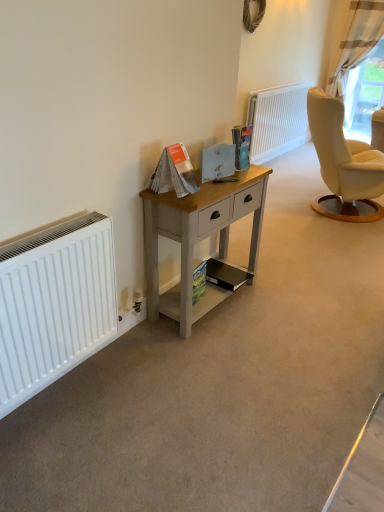
The image size is (384, 512). What are the coordinates of `matte blue card at center, which is counted as the 4th magazine, starting from the bottom` in the screenshot? It's located at (218, 161).

The height and width of the screenshot is (512, 384). What do you see at coordinates (365, 91) in the screenshot?
I see `transparent glass window at upper right` at bounding box center [365, 91].

What do you see at coordinates (199, 280) in the screenshot? I see `green matte magazine at lower center, the fifth magazine when ordered from top to bottom` at bounding box center [199, 280].

Describe the element at coordinates (242, 146) in the screenshot. I see `matte paper magazine at center, which is the first magazine from top to bottom` at that location.

Measure the distance between point [179,173] and camera.

They are 6.26 feet apart.

Locate an element on the screen. The image size is (384, 512). matte black magazine at lower center, which ranks as the 2th magazine in bottom-to-top order is located at coordinates (225, 275).

Does point (175, 205) come farther from viewer compared to point (254, 125)?

That is False.

Is light gray wood desk at center taller than white matte radiator at upper center, which appears as the first radiator when viewed from the top?

Incorrect, the height of light gray wood desk at center is not larger of that of white matte radiator at upper center, which appears as the first radiator when viewed from the top.

At what (x,y) coordinates should I click in order to perform the action: click on desk below the white matte radiator at upper center, which appears as the first radiator when viewed from the top (from the image's perspective). Please return your answer as a coordinate pair (x, y). Looking at the image, I should click on (x=198, y=238).

Is light gray wood desk at center aimed at white matte radiator at upper center, which is the second radiator in front-to-back order?

No, light gray wood desk at center is not aimed at white matte radiator at upper center, which is the second radiator in front-to-back order.

Is white matte radiator at lower left, which is the 1th radiator from left to right, not near light gray wood desk at center?

No, white matte radiator at lower left, which is the 1th radiator from left to right, is not far from light gray wood desk at center.

Which is behind, white matte radiator at lower left, which is the first radiator from bottom to top, or light gray wood desk at center?

light gray wood desk at center.

Considering the relative sizes of white matte radiator at lower left, which is the first radiator from bottom to top, and light gray wood desk at center in the image provided, is white matte radiator at lower left, which is the first radiator from bottom to top, shorter than light gray wood desk at center?

Correct, white matte radiator at lower left, which is the first radiator from bottom to top, is not as tall as light gray wood desk at center.

Can you confirm if white matte radiator at lower left, which is counted as the 2th radiator, starting from the right, is bigger than light gray wood desk at center?

No, white matte radiator at lower left, which is counted as the 2th radiator, starting from the right, is not bigger than light gray wood desk at center.

I want to click on the 1st magazine to the left when counting from the matte blue card at center, which is counted as the 4th magazine, starting from the bottom, so click(199, 280).

Does matte blue card at center, which is counted as the 4th magazine, starting from the bottom, touch green matte magazine at lower center, the fifth magazine when ordered from top to bottom?

No, matte blue card at center, which is counted as the 4th magazine, starting from the bottom, is not making contact with green matte magazine at lower center, the fifth magazine when ordered from top to bottom.

Which object is wider, matte blue card at center, which is counted as the second magazine, starting from the top, or green matte magazine at lower center, the 1th magazine positioned from the bottom?

With larger width is matte blue card at center, which is counted as the second magazine, starting from the top.

How many degrees apart are the facing directions of matte blue card at center, which is counted as the second magazine, starting from the top, and white matte radiator at upper center, which ranks as the second radiator in bottom-to-top order?

The angular difference between matte blue card at center, which is counted as the second magazine, starting from the top, and white matte radiator at upper center, which ranks as the second radiator in bottom-to-top order, is 3.82 degrees.

Based on the photo, is matte blue card at center, which is counted as the second magazine, starting from the top, thinner than white matte radiator at upper center, which ranks as the second radiator in bottom-to-top order?

Correct, the width of matte blue card at center, which is counted as the second magazine, starting from the top, is less than that of white matte radiator at upper center, which ranks as the second radiator in bottom-to-top order.

Is white matte radiator at upper center, which is counted as the second radiator, starting from the left, at the back of matte blue card at center, which is counted as the second magazine, starting from the top?

No, matte blue card at center, which is counted as the second magazine, starting from the top, is not facing the opposite direction of white matte radiator at upper center, which is counted as the second radiator, starting from the left.

Is matte blue card at center, which is counted as the second magazine, starting from the top, shorter than white matte radiator at upper center, which is counted as the first radiator, starting from the back?

Yes.

Which object is thinner, matte blue card at center, which is counted as the second magazine, starting from the top, or transparent glass window at upper right?

matte blue card at center, which is counted as the second magazine, starting from the top.

How different are the orientations of matte blue card at center, which is counted as the second magazine, starting from the top, and transparent glass window at upper right in degrees?

The facing directions of matte blue card at center, which is counted as the second magazine, starting from the top, and transparent glass window at upper right are 85.6 degrees apart.

Which of these two, matte blue card at center, which is counted as the 4th magazine, starting from the bottom, or transparent glass window at upper right, stands shorter?

matte blue card at center, which is counted as the 4th magazine, starting from the bottom, is shorter.

From a real-world perspective, which object stands above the other?

In real-world perspective, matte blue card at center, which is counted as the 4th magazine, starting from the bottom, is above.

Which of these two, light gray wood desk at center or matte paper magazine at center, arranged as the third magazine when viewed from the top, is wider?

With larger width is light gray wood desk at center.

Based on the photo, is matte paper magazine at center, marked as the 3th magazine in a bottom-to-top arrangement, inside light gray wood desk at center?

No.

This screenshot has width=384, height=512. I want to click on desk that is under the matte paper magazine at center, marked as the 3th magazine in a bottom-to-top arrangement (from a real-world perspective), so click(x=198, y=238).

Based on the photo, considering the positions of objects white matte radiator at upper center, which ranks as the second radiator in bottom-to-top order, and white textured curtain at upper right in the image provided, who is more to the left, white matte radiator at upper center, which ranks as the second radiator in bottom-to-top order, or white textured curtain at upper right?

Positioned to the left is white matte radiator at upper center, which ranks as the second radiator in bottom-to-top order.

Is white matte radiator at upper center, which ranks as the second radiator in bottom-to-top order, far away from white textured curtain at upper right?

That's right, there is a large distance between white matte radiator at upper center, which ranks as the second radiator in bottom-to-top order, and white textured curtain at upper right.

From the image's perspective, does white matte radiator at upper center, which is the second radiator in front-to-back order, appear lower than white textured curtain at upper right?

Yes, from the image's perspective, white matte radiator at upper center, which is the second radiator in front-to-back order, is below white textured curtain at upper right.

Considering the sizes of white matte radiator at upper center, which appears as the first radiator when viewed from the top, and white textured curtain at upper right in the image, is white matte radiator at upper center, which appears as the first radiator when viewed from the top, wider or thinner than white textured curtain at upper right?

Clearly, white matte radiator at upper center, which appears as the first radiator when viewed from the top, has less width compared to white textured curtain at upper right.

What are the coordinates of `desk below the white matte radiator at upper center, which is counted as the second radiator, starting from the left (from the image's perspective)` in the screenshot? It's located at (198, 238).

The image size is (384, 512). I want to click on desk behind the white matte radiator at lower left, the first radiator when ordered from front to back, so click(198, 238).

Looking at the image, which one is located closer to transparent glass window at upper right, matte paper magazine at center, arranged as the third magazine when viewed from the top, or green matte magazine at lower center, the 1th magazine positioned from the bottom?

Based on the image, green matte magazine at lower center, the 1th magazine positioned from the bottom, appears to be nearer to transparent glass window at upper right.

Estimate the real-world distances between objects in this image. Which object is closer to transparent glass window at upper right, matte paper magazine at center, which is the first magazine from top to bottom, or white matte radiator at upper center, which appears as the first radiator when viewed from the top?

Among the two, white matte radiator at upper center, which appears as the first radiator when viewed from the top, is located nearer to transparent glass window at upper right.

From the image, which object appears to be nearer to green matte magazine at lower center, the fifth magazine when ordered from top to bottom, white matte radiator at upper center, which appears as the first radiator when viewed from the top, or white textured curtain at upper right?

white matte radiator at upper center, which appears as the first radiator when viewed from the top, is positioned closer to the anchor green matte magazine at lower center, the fifth magazine when ordered from top to bottom.

Estimate the real-world distances between objects in this image. Which object is further from matte blue card at center, which is counted as the 4th magazine, starting from the bottom, matte paper magazine at center, marked as the 3th magazine in a bottom-to-top arrangement, or light gray wood desk at center?

light gray wood desk at center is further to matte blue card at center, which is counted as the 4th magazine, starting from the bottom.

Looking at the image, which one is located closer to light gray wood desk at center, transparent glass window at upper right or white textured curtain at upper right?

transparent glass window at upper right is closer to light gray wood desk at center.

Estimate the real-world distances between objects in this image. Which object is closer to white matte radiator at upper center, which is counted as the second radiator, starting from the left, matte blue card at center, which is counted as the second magazine, starting from the top, or matte paper magazine at center, which is the first magazine from top to bottom?

Among the two, matte paper magazine at center, which is the first magazine from top to bottom, is located nearer to white matte radiator at upper center, which is counted as the second radiator, starting from the left.

Considering their positions, is matte blue card at center, which is counted as the 4th magazine, starting from the bottom, positioned closer to matte paper magazine at center, the 5th magazine when ordered from bottom to top, than white textured curtain at upper right?

matte blue card at center, which is counted as the 4th magazine, starting from the bottom.

In the scene shown: Considering their positions, is matte paper magazine at center, which is the first magazine from top to bottom, positioned closer to matte black magazine at lower center, which ranks as the 2th magazine in bottom-to-top order, than transparent glass window at upper right?

The object closer to matte black magazine at lower center, which ranks as the 2th magazine in bottom-to-top order, is matte paper magazine at center, which is the first magazine from top to bottom.

Where is `magazine between matte blue card at center, which is counted as the second magazine, starting from the top, and light gray wood desk at center from top to bottom`? The width and height of the screenshot is (384, 512). magazine between matte blue card at center, which is counted as the second magazine, starting from the top, and light gray wood desk at center from top to bottom is located at coordinates (174, 172).

In order to click on desk between white matte radiator at lower left, placed as the second radiator when sorted from top to bottom, and white textured curtain at upper right, along the z-axis in this screenshot , I will do `click(198, 238)`.

Where is `magazine positioned between matte paper magazine at center, which is the first magazine from top to bottom, and white textured curtain at upper right from near to far`? magazine positioned between matte paper magazine at center, which is the first magazine from top to bottom, and white textured curtain at upper right from near to far is located at coordinates (225, 275).

Where is `desk between matte blue card at center, which is counted as the 4th magazine, starting from the bottom, and green matte magazine at lower center, the 1th magazine positioned from the bottom, from top to bottom`? The height and width of the screenshot is (512, 384). desk between matte blue card at center, which is counted as the 4th magazine, starting from the bottom, and green matte magazine at lower center, the 1th magazine positioned from the bottom, from top to bottom is located at coordinates [x=198, y=238].